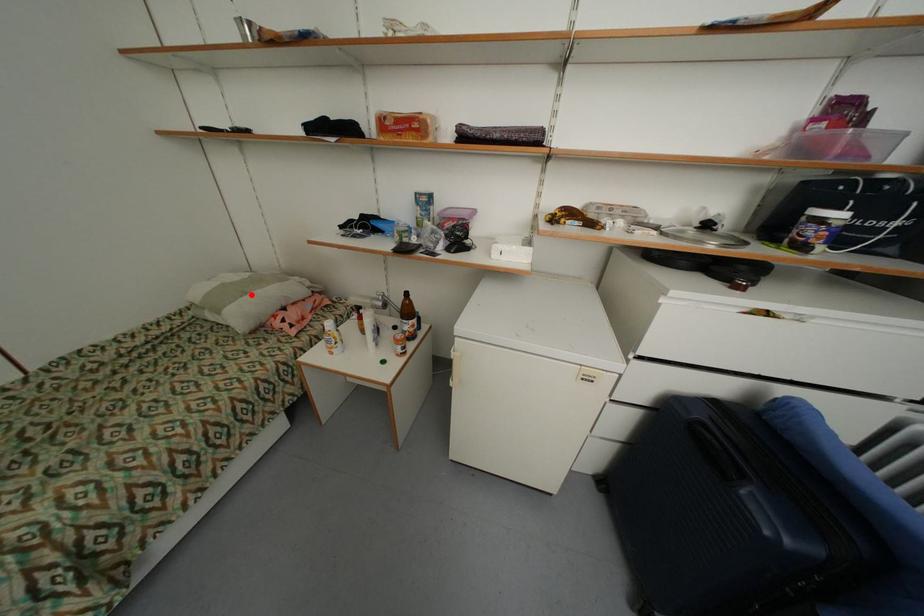
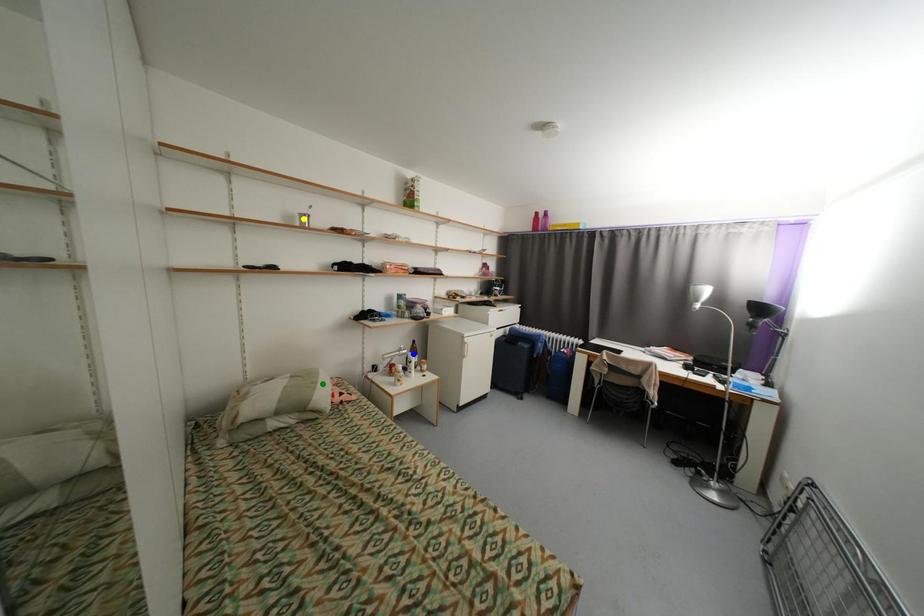
Question: I am providing you with two images of the same scene from different viewpoints. A red point is marked on the first image. You are given multiple points on the second image. In image 2, which mark is for the same physical point as the one in image 1?

Choices:
 (A) yellow point
 (B) blue point
 (C) green point

Answer: (C)